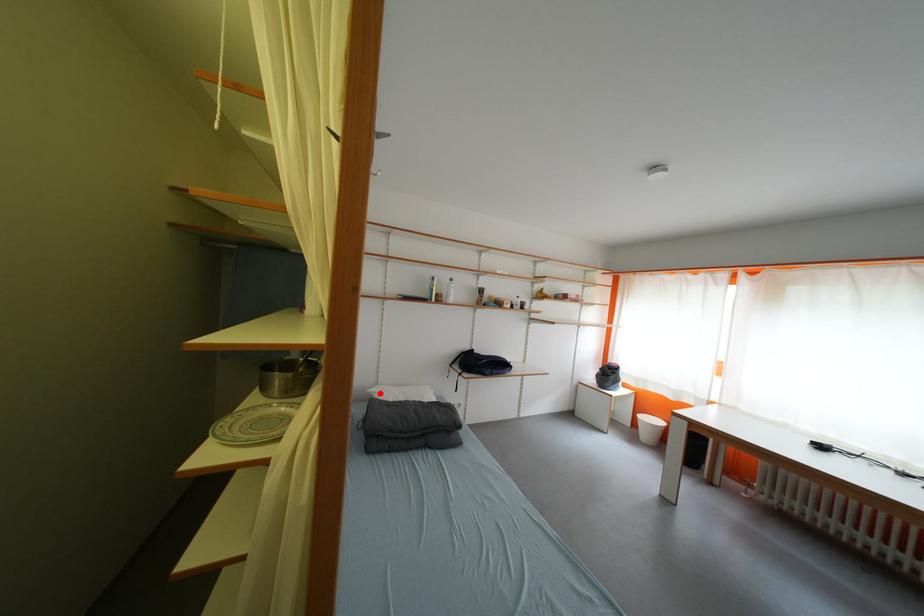
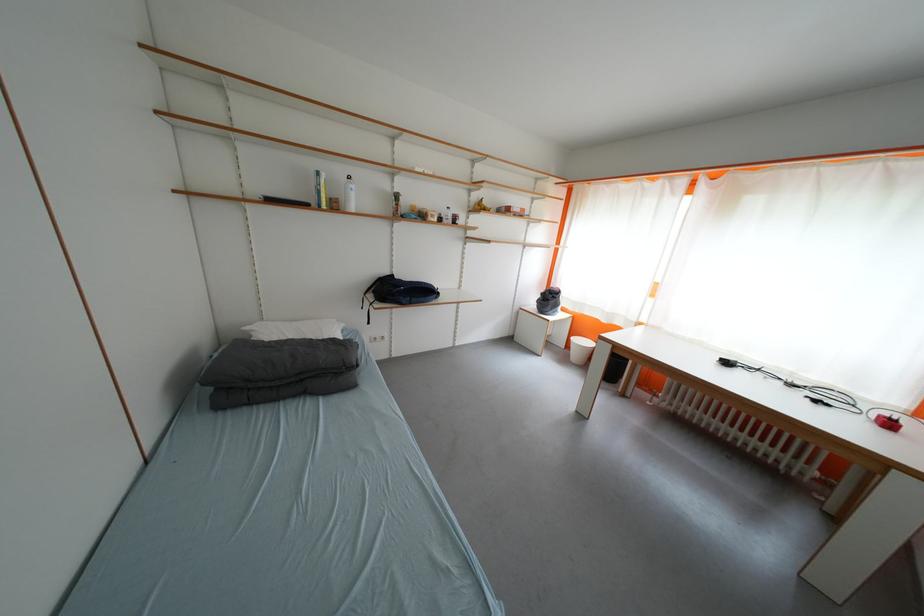
Question: I am providing you with two images of the same scene from different viewpoints. A red point is marked on the first image. At the location where the point appears in image 1, is it still visible in image 2?

Choices:
 (A) Yes
 (B) No

Answer: (A)